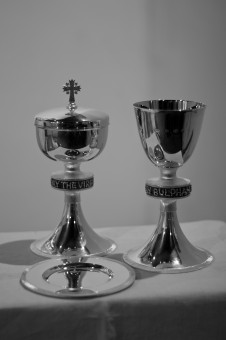
Where is `base of glass`? base of glass is located at coordinates (79, 228), (178, 239).